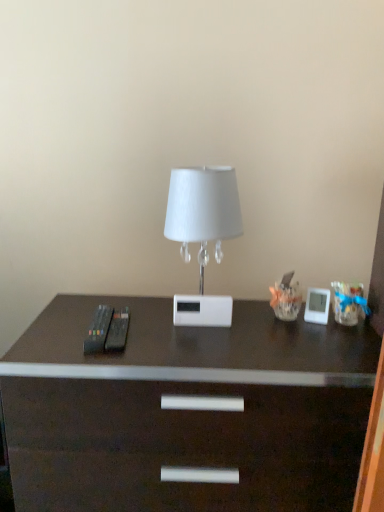
Question: From a real-world perspective, relative to white glossy lamp at center, is dark wood desk at center vertically above or below?

Choices:
 (A) below
 (B) above

Answer: (A)

Question: In terms of height, does dark wood desk at center look taller or shorter compared to white glossy lamp at center?

Choices:
 (A) tall
 (B) short

Answer: (A)

Question: Is dark wood desk at center wider or thinner than white glossy lamp at center?

Choices:
 (A) wide
 (B) thin

Answer: (A)

Question: In terms of width, does white glossy lamp at center look wider or thinner when compared to dark wood desk at center?

Choices:
 (A) thin
 (B) wide

Answer: (A)

Question: Which is correct: white glossy lamp at center is inside dark wood desk at center, or outside of it?

Choices:
 (A) outside
 (B) inside

Answer: (A)

Question: Is white glossy lamp at center bigger or smaller than dark wood desk at center?

Choices:
 (A) big
 (B) small

Answer: (B)

Question: Considering their positions, is white glossy lamp at center located in front of or behind dark wood desk at center?

Choices:
 (A) front
 (B) behind

Answer: (B)